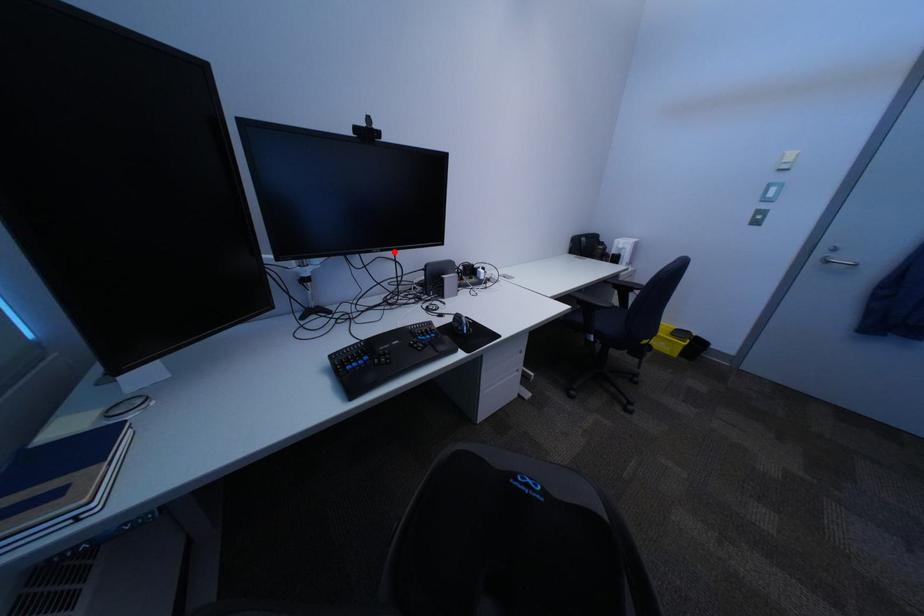
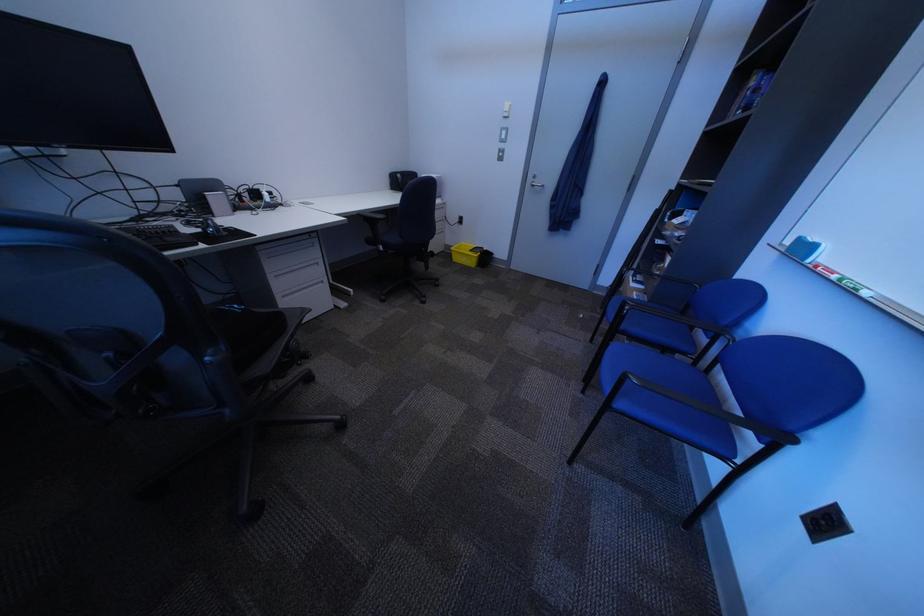
Find the pixel in the second image that matches the highlighted location in the first image.

(80, 148)